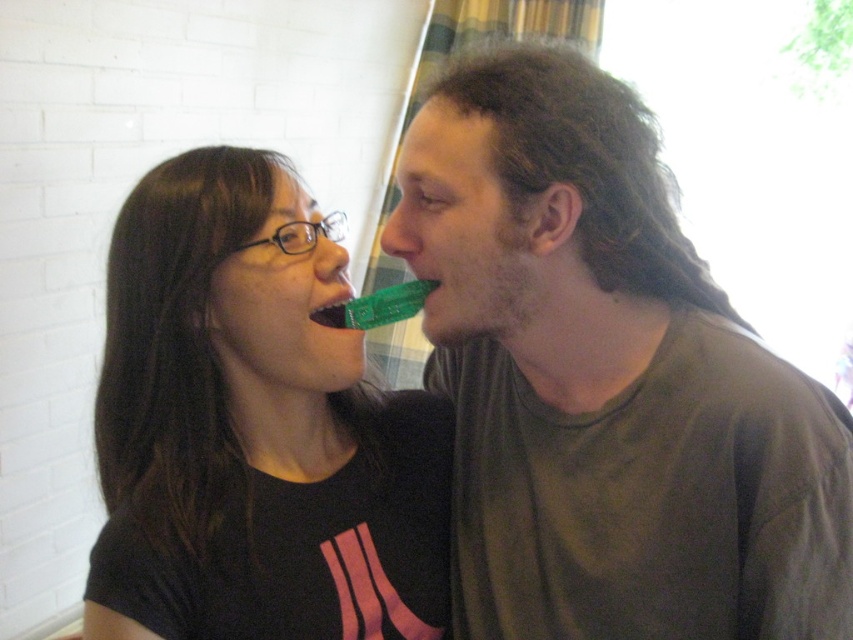
Question: Can you confirm if green plastic toothbrush at upper right is positioned above matte black t-shirt at center?

Choices:
 (A) yes
 (B) no

Answer: (A)

Question: Does green plastic toothbrush at upper right have a greater width compared to matte black t-shirt at center?

Choices:
 (A) no
 (B) yes

Answer: (A)

Question: Does green plastic toothbrush at upper right have a larger size compared to matte black t-shirt at center?

Choices:
 (A) yes
 (B) no

Answer: (A)

Question: Which object is farther from the camera taking this photo?

Choices:
 (A) matte black t-shirt at center
 (B) green plastic toothbrush at upper right

Answer: (A)

Question: Which point is closer to the camera taking this photo?

Choices:
 (A) (665, 308)
 (B) (242, 636)

Answer: (B)